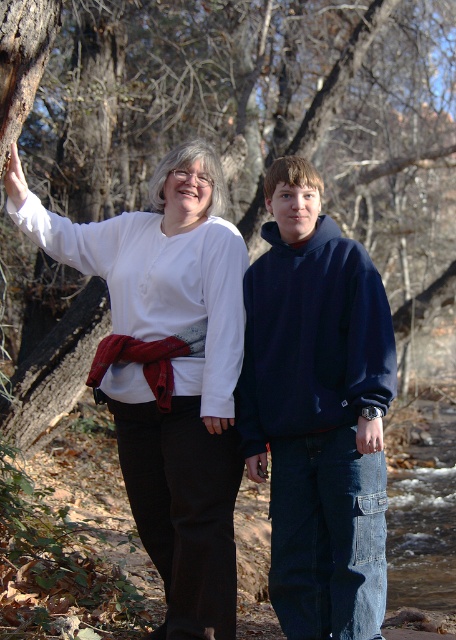
Is white matte shirt at upper left positioned before navy blue hoodie at center?

Yes, it is in front of navy blue hoodie at center.

Between point (226, 627) and point (378, 438), which one is positioned in front?

Point (378, 438) is in front.

At what (x,y) coordinates should I click in order to perform the action: click on white matte shirt at upper left. Please return your answer as a coordinate pair (x, y). This screenshot has height=640, width=456. Looking at the image, I should click on (169, 372).

Is smooth bark tree trunk at left bigger than white matte shirt at upper left?

Indeed, smooth bark tree trunk at left has a larger size compared to white matte shirt at upper left.

Which of these two, smooth bark tree trunk at left or white matte shirt at upper left, stands taller?

With more height is smooth bark tree trunk at left.

This screenshot has height=640, width=456. I want to click on smooth bark tree trunk at left, so click(300, 116).

You are a GUI agent. You are given a task and a screenshot of the screen. Output one action in this format:
    pyautogui.click(x=<x>, y=<y>)
    Task: Click on the smooth bark tree trunk at left
    
    Given the screenshot: What is the action you would take?
    tap(300, 116)

Does smooth bark tree trunk at left have a lesser height compared to navy blue hoodie at center?

No.

Can you confirm if smooth bark tree trunk at left is bigger than navy blue hoodie at center?

Yes.

Between point (404, 180) and point (357, 262), which one is positioned behind?

Positioned behind is point (404, 180).

Find the location of `smooth bark tree trunk at left`. smooth bark tree trunk at left is located at coordinates (300, 116).